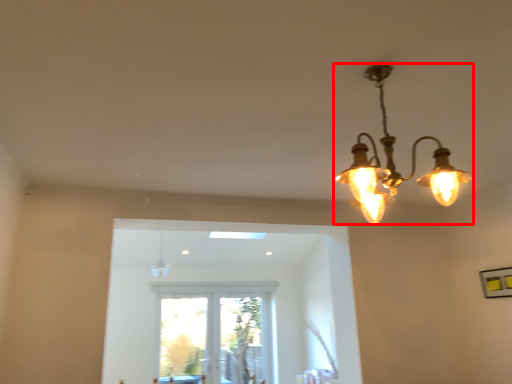
Question: Where is lamp (annotated by the red box) located in relation to lamp in the image?

Choices:
 (A) right
 (B) left

Answer: (A)